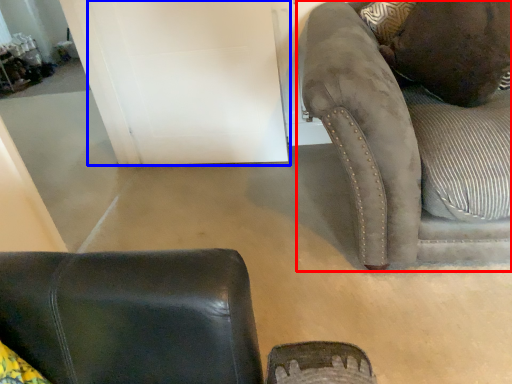
Question: Which object appears farthest to the camera in this image, studio couch (highlighted by a red box) or door (highlighted by a blue box)?

Choices:
 (A) studio couch
 (B) door

Answer: (B)